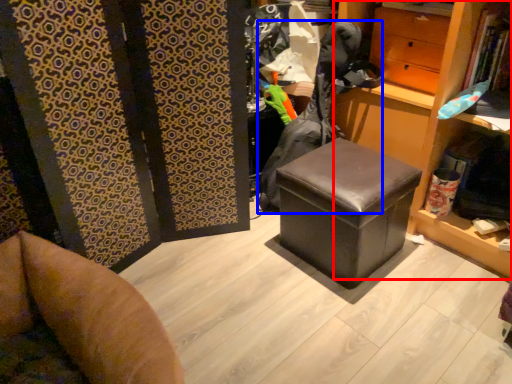
Question: Which object appears closest to the camera in this image, bookshelf (highlighted by a red box) or clothing (highlighted by a blue box)?

Choices:
 (A) bookshelf
 (B) clothing

Answer: (A)